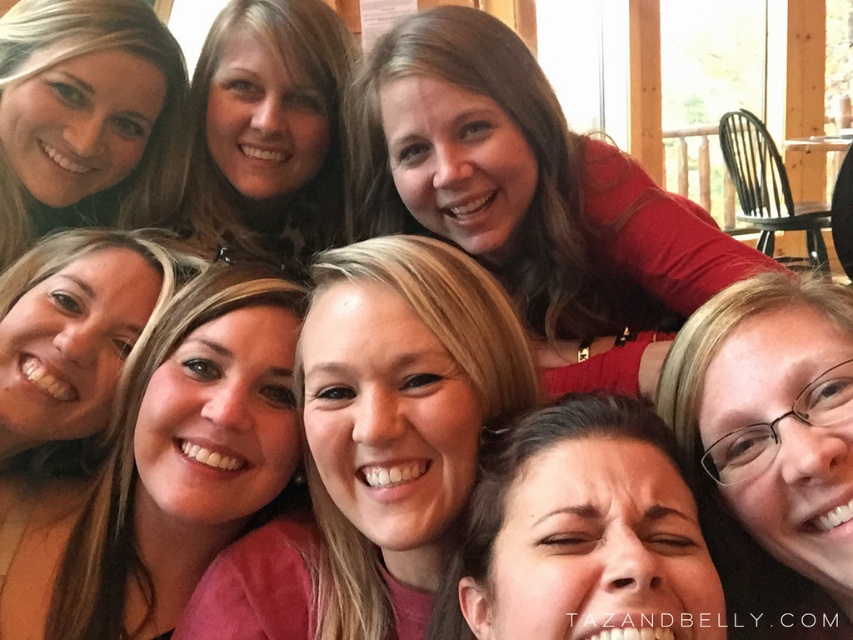
Question: Can you confirm if matte red shirt at upper center is wider than blonde hair at upper left?

Choices:
 (A) no
 (B) yes

Answer: (B)

Question: Can you confirm if pink fabric at center is positioned below smooth skin at center?

Choices:
 (A) no
 (B) yes

Answer: (B)

Question: Among these objects, which one is farthest from the camera?

Choices:
 (A) blonde hair at upper left
 (B) matte red shirt at upper center
 (C) pink fabric at center

Answer: (A)

Question: Estimate the real-world distances between objects in this image. Which object is closer to the pink matte shirt at center?

Choices:
 (A) matte red shirt at upper center
 (B) pink fabric at center
 (C) smooth skin at center
 (D) blonde hair at upper left

Answer: (B)

Question: Does pink matte shirt at center appear on the left side of smooth skin at center?

Choices:
 (A) no
 (B) yes

Answer: (A)

Question: Considering the real-world distances, which object is farthest from the smooth skin at center?

Choices:
 (A) pink matte shirt at center
 (B) blonde hair at upper left

Answer: (A)